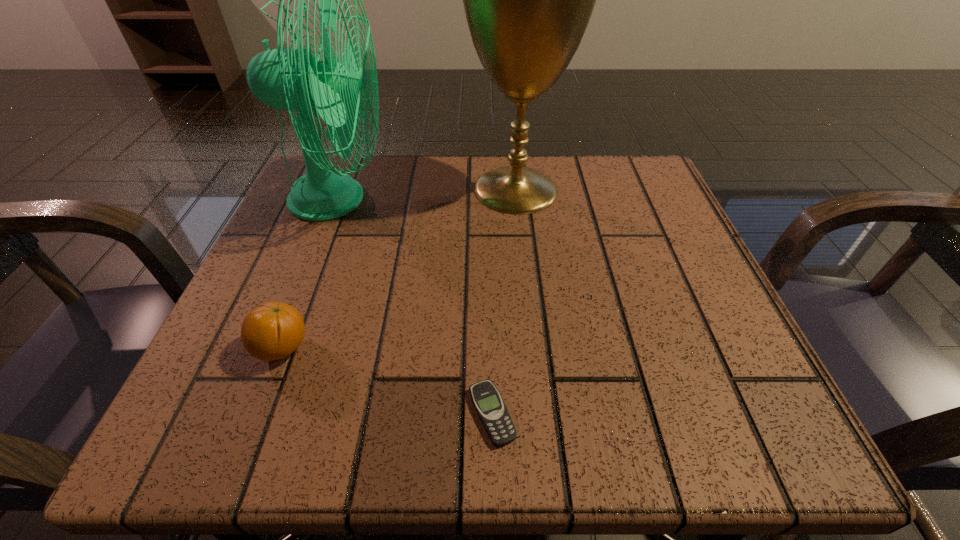
At what (x,y) coordinates should I click in order to perform the action: click on trophy cup positioned at the far edge. Please return your answer as a coordinate pair (x, y). Image resolution: width=960 pixels, height=540 pixels. Looking at the image, I should click on (528, 0).

You are a GUI agent. You are given a task and a screenshot of the screen. Output one action in this format:
    pyautogui.click(x=<x>, y=<y>)
    Task: Click on the fan positioned at the far edge
    This screenshot has height=540, width=960.
    Given the screenshot: What is the action you would take?
    (x=291, y=79)

Locate an element on the screen. The image size is (960, 540). object positioned at the near edge is located at coordinates (489, 405).

What are the coordinates of `fan situated at the left edge` in the screenshot? It's located at (291, 79).

At what (x,y) coordinates should I click in order to perform the action: click on orange that is positioned at the left edge. Please return your answer as a coordinate pair (x, y). Looking at the image, I should click on (272, 331).

Locate an element on the screen. object at the far left corner is located at coordinates (291, 79).

The height and width of the screenshot is (540, 960). I want to click on free space at the far edge of the desktop, so click(x=564, y=155).

Locate an element on the screen. The image size is (960, 540). blank space at the near edge is located at coordinates (305, 441).

In the image, there is a desktop. Where is `free space at the left edge`? The width and height of the screenshot is (960, 540). free space at the left edge is located at coordinates (334, 312).

Find the location of a particular element. The image size is (960, 540). vacant region at the right edge of the desktop is located at coordinates coord(657,261).